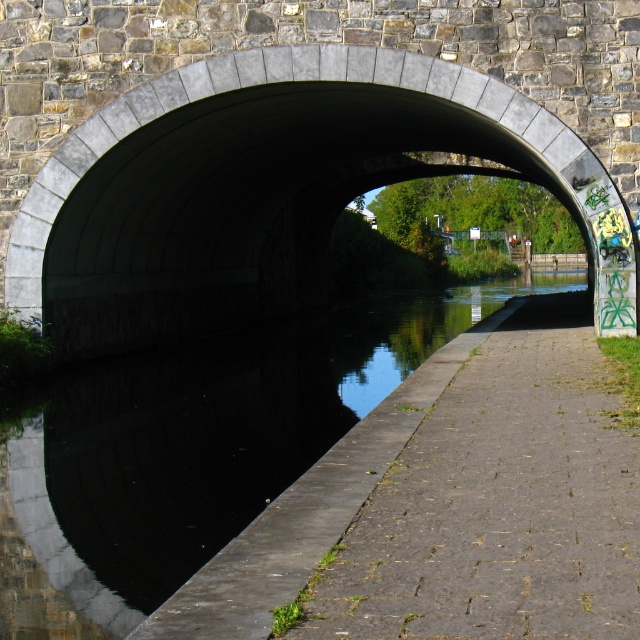
Between concrete archway at center and concrete paving at lower right, which one has less height?

concrete paving at lower right

Between concrete archway at center and concrete paving at lower right, which one is positioned higher?

concrete archway at center is above.

Locate an element on the screen. The width and height of the screenshot is (640, 640). concrete archway at center is located at coordinates (273, 186).

Which of these two, concrete archway at center or black concrete water at center, stands taller?

concrete archway at center is taller.

Is concrete archway at center closer to camera compared to black concrete water at center?

No, it is not.

Which is behind, point (595, 218) or point (145, 403)?

Point (145, 403)

Where is `concrete archway at center`? concrete archway at center is located at coordinates (273, 186).

Does black concrete water at center have a greater width compared to concrete paving at lower right?

Correct, the width of black concrete water at center exceeds that of concrete paving at lower right.

Locate an element on the screen. black concrete water at center is located at coordinates (195, 449).

The height and width of the screenshot is (640, 640). I want to click on black concrete water at center, so click(195, 449).